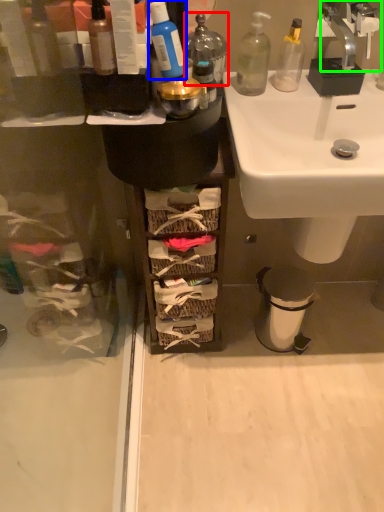
Question: Considering the real-world distances, which object is farthest from toiletry (highlighted by a red box)? toiletry (highlighted by a blue box) or tap (highlighted by a green box)?

Choices:
 (A) toiletry
 (B) tap

Answer: (B)